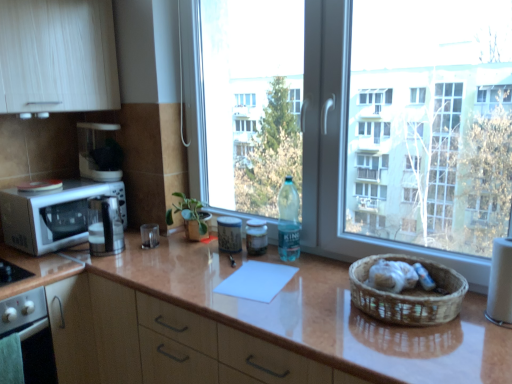
I want to click on vacant space situated on the left part of brown woven basket at right, so click(x=309, y=306).